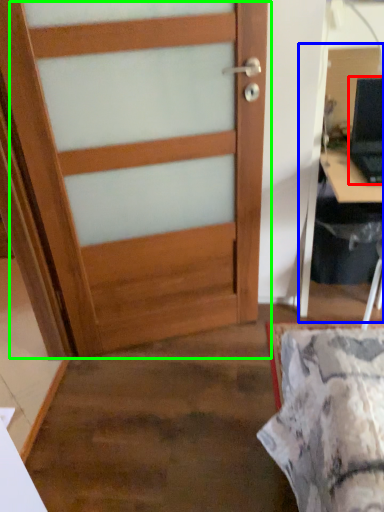
Question: Which is farther away from laptop (highlighted by a red box)? computer desk (highlighted by a blue box) or door (highlighted by a green box)?

Choices:
 (A) computer desk
 (B) door

Answer: (B)